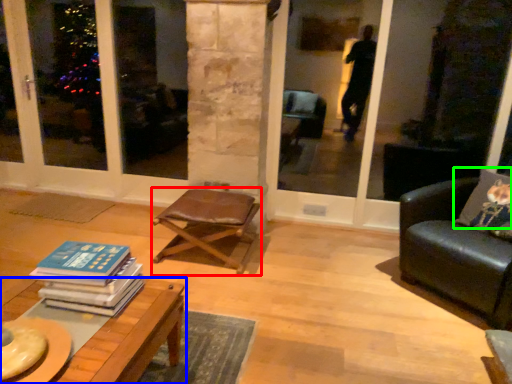
Question: Which object is positioned farthest from chair (highlighted by a red box)? Select from table (highlighted by a blue box) and pillow (highlighted by a green box).

Choices:
 (A) table
 (B) pillow

Answer: (B)